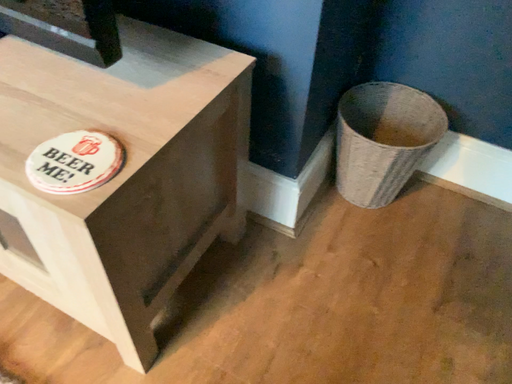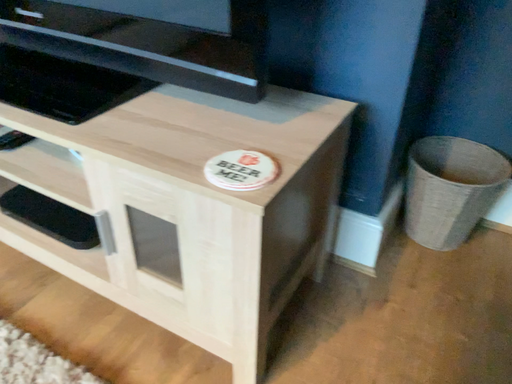
Question: How did the camera likely rotate when shooting the video?

Choices:
 (A) rotated upward
 (B) rotated downward

Answer: (A)